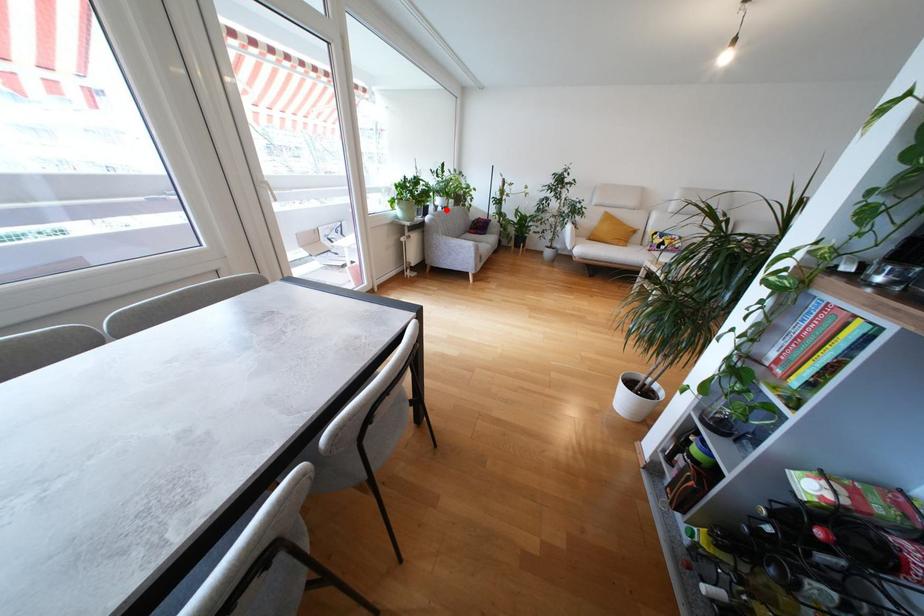
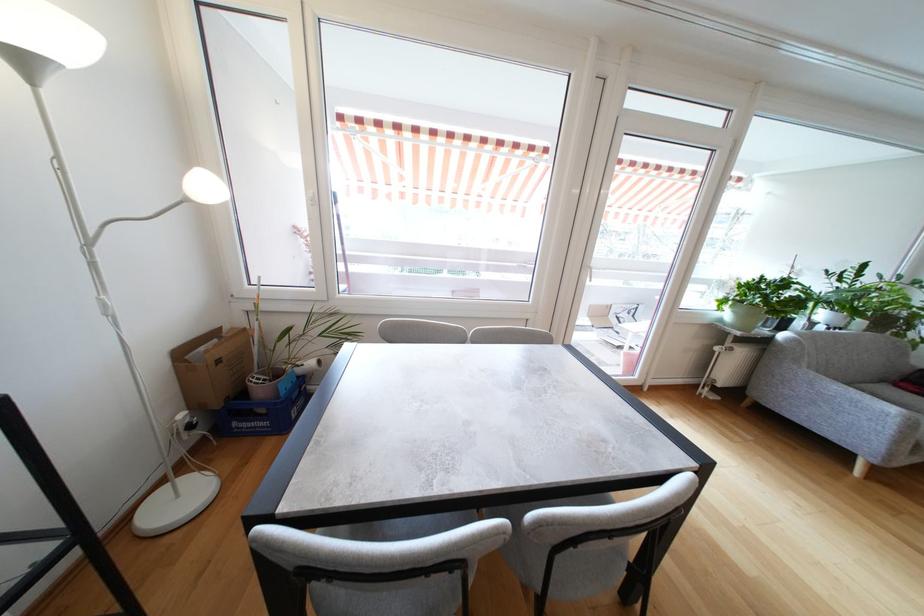
In the second image, find the point that corresponds to the highlighted location in the first image.

(833, 330)